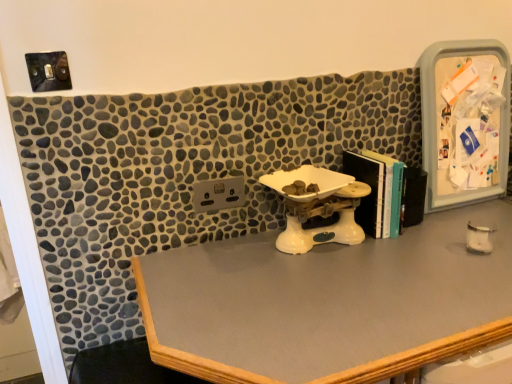
At what (x,y) coordinates should I click in order to perform the action: click on smooth gray desk at center. Please return your answer as a coordinate pair (x, y). Looking at the image, I should click on (328, 303).

Describe the element at coordinates (318, 207) in the screenshot. I see `white plastic scale at center` at that location.

This screenshot has width=512, height=384. What are the coordinates of `plastic/transparent medicine cabinet at right` in the screenshot? It's located at (465, 121).

Can white plastic scale at center be found inside smooth gray desk at center?

Actually, white plastic scale at center is outside smooth gray desk at center.

Would you say smooth gray desk at center is to the left or to the right of white plastic scale at center in the picture?

From the image, it's evident that smooth gray desk at center is to the right of white plastic scale at center.

At what (x,y) coordinates should I click in order to perform the action: click on desk below the white plastic scale at center (from a real-world perspective). Please return your answer as a coordinate pair (x, y). Image resolution: width=512 pixels, height=384 pixels. Looking at the image, I should click on (328, 303).

Could you tell me if smooth gray desk at center is turned towards white plastic scale at center?

No, smooth gray desk at center is not aimed at white plastic scale at center.

From the image's perspective, which one is positioned lower, smooth gray desk at center or hardcover books at center-right?

smooth gray desk at center is shown below in the image.

Which of these two, smooth gray desk at center or hardcover books at center-right, stands shorter?

hardcover books at center-right.

Who is more distant, smooth gray desk at center or hardcover books at center-right?

hardcover books at center-right is behind.

How many degrees apart are the facing directions of smooth gray desk at center and hardcover books at center-right?

0.228 degrees separate the facing orientations of smooth gray desk at center and hardcover books at center-right.

From the image's perspective, which one is positioned higher, smooth gray desk at center or plastic/transparent medicine cabinet at right?

plastic/transparent medicine cabinet at right, from the image's perspective.

Is point (473, 306) less distant than point (445, 54)?

That is True.

Which of these two, smooth gray desk at center or plastic/transparent medicine cabinet at right, is wider?

With larger width is smooth gray desk at center.

Which is behind, smooth gray desk at center or plastic/transparent medicine cabinet at right?

Positioned behind is plastic/transparent medicine cabinet at right.

From a real-world perspective, is plastic/transparent medicine cabinet at right located beneath hardcover books at center-right?

No.

Which object is positioned more to the right, plastic/transparent medicine cabinet at right or hardcover books at center-right?

plastic/transparent medicine cabinet at right.

From the picture: From the image's perspective, which is below, plastic/transparent medicine cabinet at right or hardcover books at center-right?

hardcover books at center-right appears lower in the image.

Are hardcover books at center-right and smooth gray desk at center located far from each other?

They are positioned close to each other.

From the picture: Is hardcover books at center-right situated inside smooth gray desk at center or outside?

hardcover books at center-right is not inside smooth gray desk at center, it's outside.

Is point (372, 223) closer or farther from the camera than point (232, 380)?

Point (372, 223) is positioned farther from the camera compared to point (232, 380).

Considering the relative positions of hardcover books at center-right and smooth gray desk at center in the image provided, is hardcover books at center-right to the left of smooth gray desk at center from the viewer's perspective?

Correct, you'll find hardcover books at center-right to the left of smooth gray desk at center.

From a real-world perspective, is white plastic scale at center under hardcover books at center-right?

Yes, from a real-world perspective, white plastic scale at center is under hardcover books at center-right.

Is white plastic scale at center aimed at hardcover books at center-right?

No, white plastic scale at center is not turned towards hardcover books at center-right.

Considering the sizes of objects white plastic scale at center and hardcover books at center-right in the image provided, who is shorter, white plastic scale at center or hardcover books at center-right?

white plastic scale at center is shorter.

From the image's perspective, which object appears higher, plastic/transparent medicine cabinet at right or smooth gray desk at center?

From the image's view, plastic/transparent medicine cabinet at right is above.

How many degrees apart are the facing directions of plastic/transparent medicine cabinet at right and smooth gray desk at center?

0.227 degrees separate the facing orientations of plastic/transparent medicine cabinet at right and smooth gray desk at center.

Is plastic/transparent medicine cabinet at right situated inside smooth gray desk at center or outside?

The correct answer is: outside.

This screenshot has height=384, width=512. I want to click on sink lying behind the smooth gray desk at center, so click(318, 207).

Identify the location of book that is above the smooth gray desk at center (from a real-world perspective). (377, 192).

Which object lies nearer to the anchor point hardcover books at center-right, white plastic scale at center or smooth gray desk at center?

white plastic scale at center is closer to hardcover books at center-right.

Looking at the image, which one is located further to plastic/transparent medicine cabinet at right, smooth gray desk at center or white plastic scale at center?

smooth gray desk at center is positioned further to the anchor plastic/transparent medicine cabinet at right.

Estimate the real-world distances between objects in this image. Which object is further from white plastic scale at center, hardcover books at center-right or smooth gray desk at center?

smooth gray desk at center lies further to white plastic scale at center than the other object.

Considering their positions, is white plastic scale at center positioned closer to smooth gray desk at center than plastic/transparent medicine cabinet at right?

white plastic scale at center.

Considering their positions, is hardcover books at center-right positioned further to smooth gray desk at center than plastic/transparent medicine cabinet at right?

Among the two, plastic/transparent medicine cabinet at right is located further to smooth gray desk at center.

Looking at the image, which one is located further to plastic/transparent medicine cabinet at right, smooth gray desk at center or hardcover books at center-right?

smooth gray desk at center lies further to plastic/transparent medicine cabinet at right than the other object.

Estimate the real-world distances between objects in this image. Which object is closer to hardcover books at center-right, plastic/transparent medicine cabinet at right or smooth gray desk at center?

The object closer to hardcover books at center-right is smooth gray desk at center.

Looking at the image, which one is located further to white plastic scale at center, plastic/transparent medicine cabinet at right or hardcover books at center-right?

plastic/transparent medicine cabinet at right is positioned further to the anchor white plastic scale at center.

Find the location of a particular element. book between plastic/transparent medicine cabinet at right and smooth gray desk at center in the up-down direction is located at coordinates (377, 192).

Where is `sink between hardcover books at center-right and smooth gray desk at center from top to bottom`? sink between hardcover books at center-right and smooth gray desk at center from top to bottom is located at coordinates (318, 207).

Identify the location of sink that lies between plastic/transparent medicine cabinet at right and smooth gray desk at center from top to bottom. (318, 207).

The image size is (512, 384). Identify the location of book between white plastic scale at center and plastic/transparent medicine cabinet at right. (377, 192).